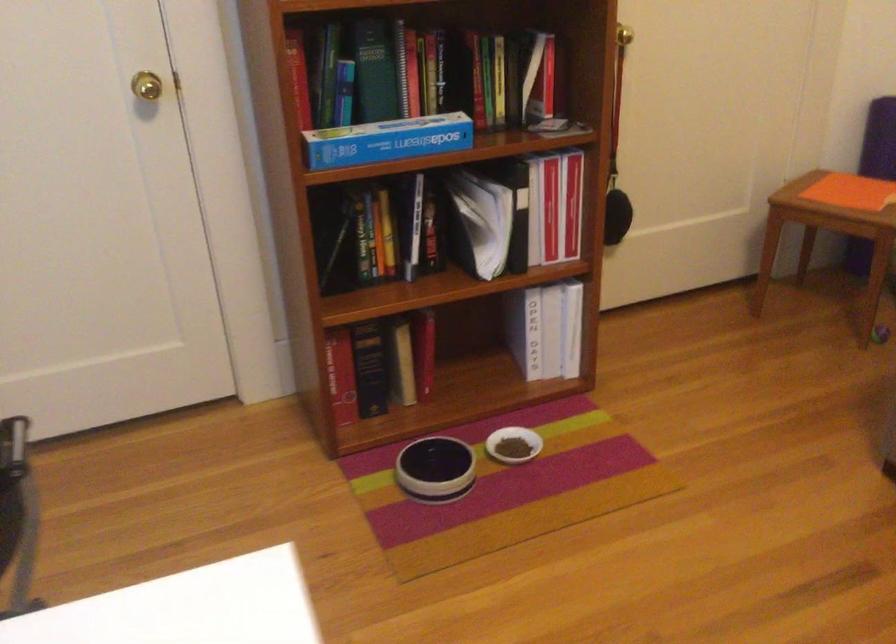
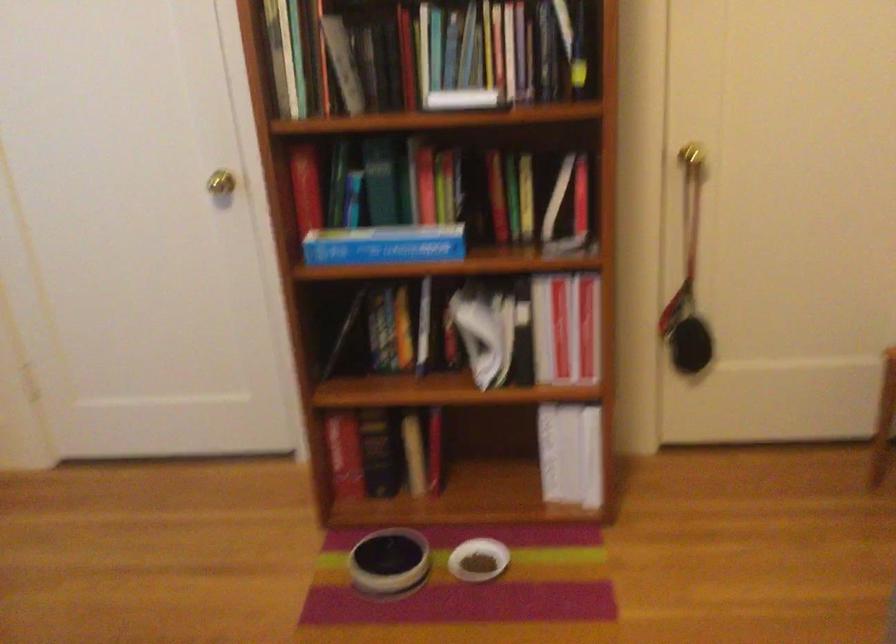
Question: The camera is either moving clockwise (left) or counter-clockwise (right) around the object. The first image is from the beginning of the video and the second image is from the end. Is the camera moving left or right when shooting the video?

Choices:
 (A) Left
 (B) Right

Answer: (B)